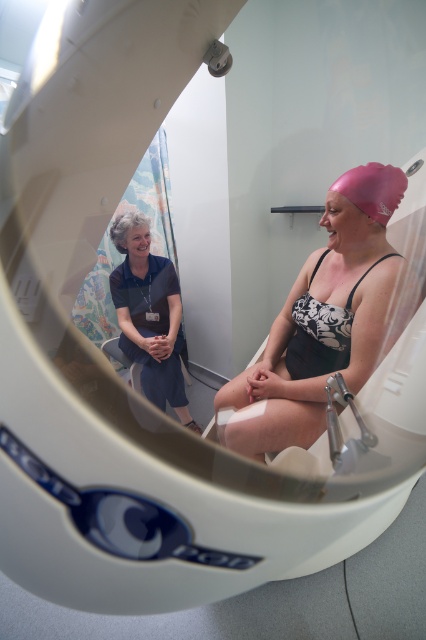
You are a technician operating an MRI scanner and need to ensure the patient is positioned correctly. The pink matte swim cap at upper right must be at least 36 inches away from the scanner entrance to avoid interference. Is the current distance sufficient?

The distance between the pink matte swim cap at upper right and the camera is 32.78 inches, which is less than the required 36 inches. Therefore, the current distance is insufficient to avoid interference.

You are a technician standing at the control panel in the MRI room. You need to place a small sensor exactly at point (305, 353) inside the MRI machine. If your reach extends 1.05 meters from your body, will you be able to reach that point?

The distance of point (305, 353) from the camera is 1.10 meters. Since your reach extends 1.05 meters, you cannot reach the point as it is slightly farther away than your maximum reach.